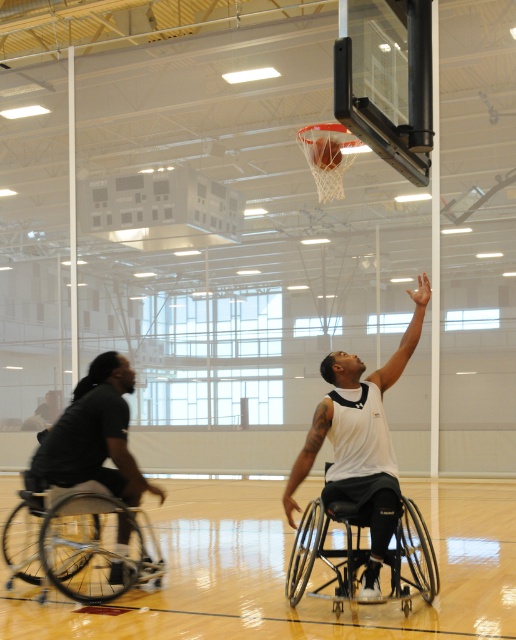
You are a photographer positioned at the back of the gymnasium. You want to take a photo of both the white matte wheelchair at center and the dark gray fabric wheelchair at left. Which wheelchair will appear larger in your photo?

The white matte wheelchair at center will appear larger in the photo because it is closer to the viewer than the dark gray fabric wheelchair at left.

You are a referee in the gymnasium observing the basketball game. You notice two points marked on the court at coordinates point (328, 477) and point (42, 449). Which point is closer to the basketball hoop located at the front of the court?

Point (328, 477) is in front of point (42, 449), so it is closer to the basketball hoop located at the front of the court.

You are a referee observing the game. You notice the silver metallic wheelchair at left and the rubber textured basketball at center. Which object is closer to the front of the court?

The silver metallic wheelchair at left is closer to the front of the court because it is positioned in front of the rubber textured basketball at center.